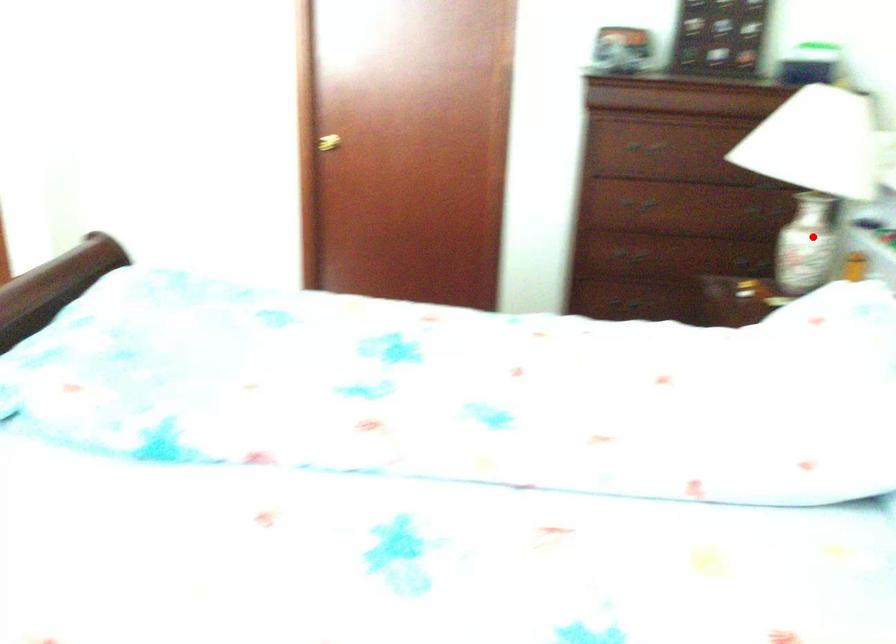
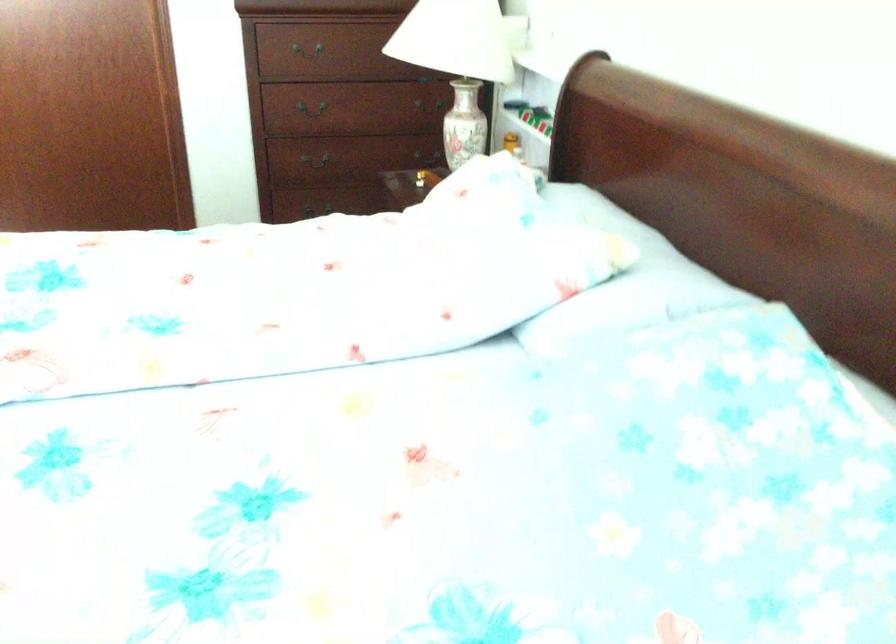
Question: I am providing you with two images of the same scene from different viewpoints. Given a red point in image1, look at the same physical point in image2. Is it:

Choices:
 (A) Closer to the viewpoint
 (B) Farther from the viewpoint

Answer: (B)